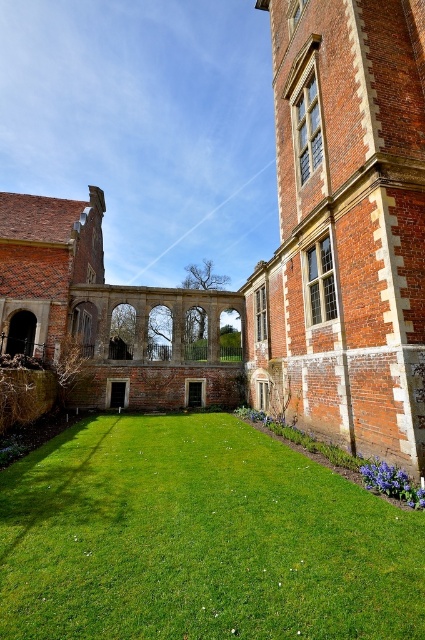
Question: Is brick wall at right bigger than red brick arches at center?

Choices:
 (A) no
 (B) yes

Answer: (A)

Question: Among these points, which one is farthest from the camera?

Choices:
 (A) (62, 232)
 (B) (419, 566)

Answer: (A)

Question: Can you confirm if green grass at center is thinner than red brick arches at center?

Choices:
 (A) yes
 (B) no

Answer: (A)

Question: Among these points, which one is farthest from the camera?

Choices:
 (A) (397, 93)
 (B) (73, 540)
 (C) (110, 392)

Answer: (C)

Question: Observing the image, what is the correct spatial positioning of brick wall at right in reference to red brick arches at center?

Choices:
 (A) right
 (B) left

Answer: (A)

Question: Which of these objects is positioned farthest from the green grass at center?

Choices:
 (A) red brick arches at center
 (B) brick wall at right

Answer: (A)